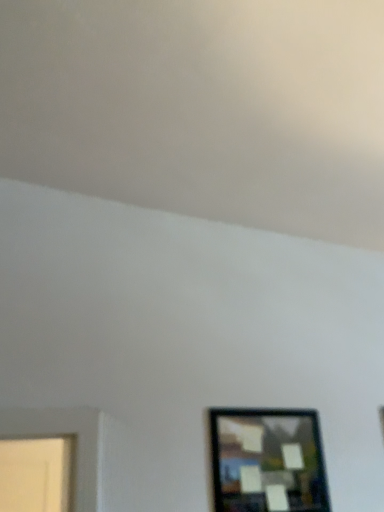
I want to click on matte black picture frame at lower right, so click(x=268, y=461).

This screenshot has width=384, height=512. What do you see at coordinates (268, 461) in the screenshot?
I see `matte black picture frame at lower right` at bounding box center [268, 461].

Find the location of a particular element. matte black picture frame at lower right is located at coordinates (268, 461).